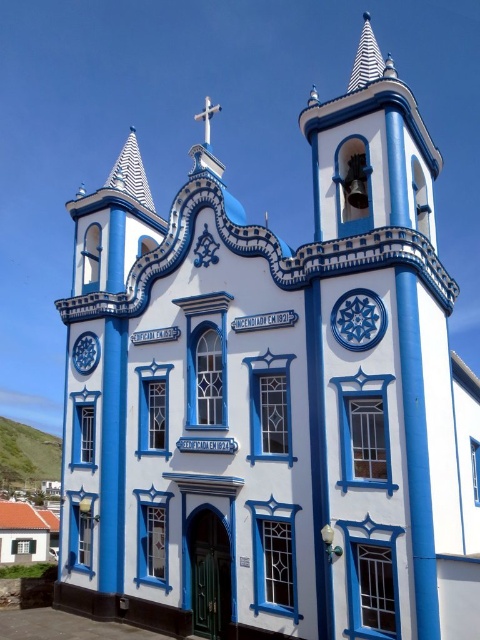
Question: Does white striped spire at upper left appear under white striped spire at upper center?

Choices:
 (A) no
 (B) yes

Answer: (B)

Question: Does white striped spire at upper center have a smaller size compared to white painted wood cross at upper center?

Choices:
 (A) yes
 (B) no

Answer: (B)

Question: Estimate the real-world distances between objects in this image. Which object is farther from the white striped spire at upper left?

Choices:
 (A) blue glossy clock at center
 (B) white striped spire at upper center
 (C) white painted wood cross at upper center

Answer: (B)

Question: Which point is closer to the camera taking this photo?

Choices:
 (A) (352, 308)
 (B) (141, 166)
 (C) (94, 333)

Answer: (A)

Question: Which of the following is the closest to the observer?

Choices:
 (A) matte blue clock at upper left
 (B) blue glossy clock at center
 (C) white striped spire at upper left
 (D) white painted wood cross at upper center

Answer: (B)

Question: Is blue glossy clock at center bigger than white painted wood cross at upper center?

Choices:
 (A) no
 (B) yes

Answer: (A)